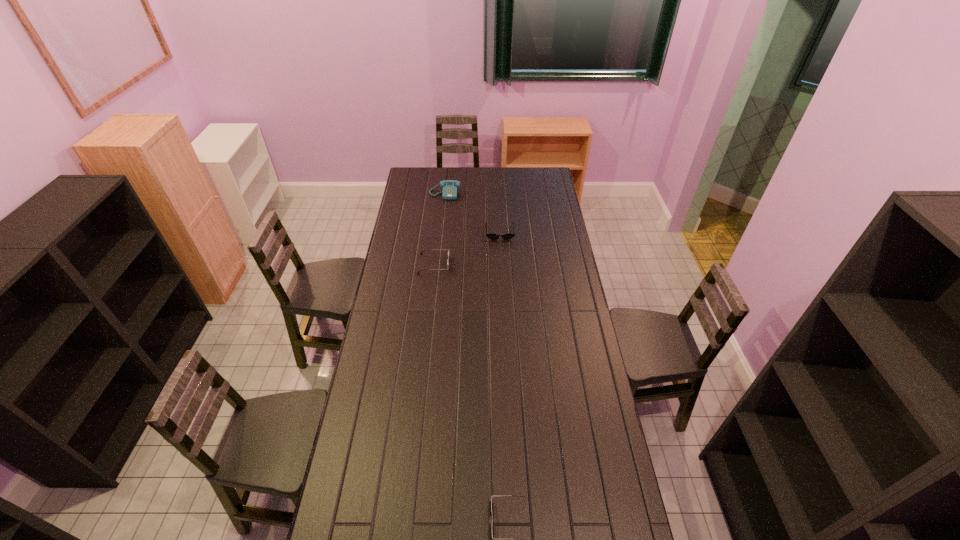
Locate an element on the screen. vacant point located between the farthest object and the second farthest object is located at coordinates (472, 213).

In order to click on vacant space that's between the tallest object and the second farthest sunglasses in this screenshot , I will do click(x=440, y=229).

Select which object appears as the third closest to the third nearest object. Please provide its 2D coordinates. Your answer should be formatted as a tuple, i.e. [(x, y)], where the tuple contains the x and y coordinates of a point satisfying the conditions above.

[(520, 496)]

Choose which object is the nearest neighbor to the farthest object. Please provide its 2D coordinates. Your answer should be formatted as a tuple, i.e. [(x, y)], where the tuple contains the x and y coordinates of a point satisfying the conditions above.

[(491, 236)]

Locate which sunglasses ranks in proximity to the farthest sunglasses. Please provide its 2D coordinates. Your answer should be formatted as a tuple, i.e. [(x, y)], where the tuple contains the x and y coordinates of a point satisfying the conditions above.

[(425, 249)]

Find the location of a particular element. sunglasses that is the second closest to the tallest object is located at coordinates (425, 249).

Where is `vacant region that satisfies the following two spatial constraints: 1. on the front-facing side of the farthest sunglasses; 2. on the front-facing side of the leftmost sunglasses`? Image resolution: width=960 pixels, height=540 pixels. vacant region that satisfies the following two spatial constraints: 1. on the front-facing side of the farthest sunglasses; 2. on the front-facing side of the leftmost sunglasses is located at coordinates (501, 264).

This screenshot has height=540, width=960. Find the location of `blank area in the image that satisfies the following two spatial constraints: 1. on the dial of the tallest object; 2. on the front-facing side of the tallest sunglasses`. blank area in the image that satisfies the following two spatial constraints: 1. on the dial of the tallest object; 2. on the front-facing side of the tallest sunglasses is located at coordinates (438, 264).

Locate an element on the screen. The height and width of the screenshot is (540, 960). vacant space that satisfies the following two spatial constraints: 1. on the dial of the farthest object; 2. on the front-facing side of the tallest sunglasses is located at coordinates (438, 264).